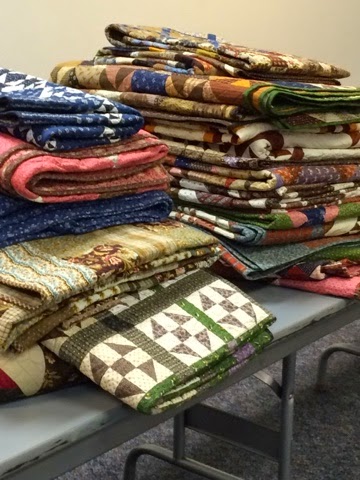
At what (x,y) coordinates should I click in order to perform the action: click on blacnket with green and white parts on it. Please return your answer as a coordinate pair (x, y). The image size is (360, 480). Looking at the image, I should click on (208, 311).